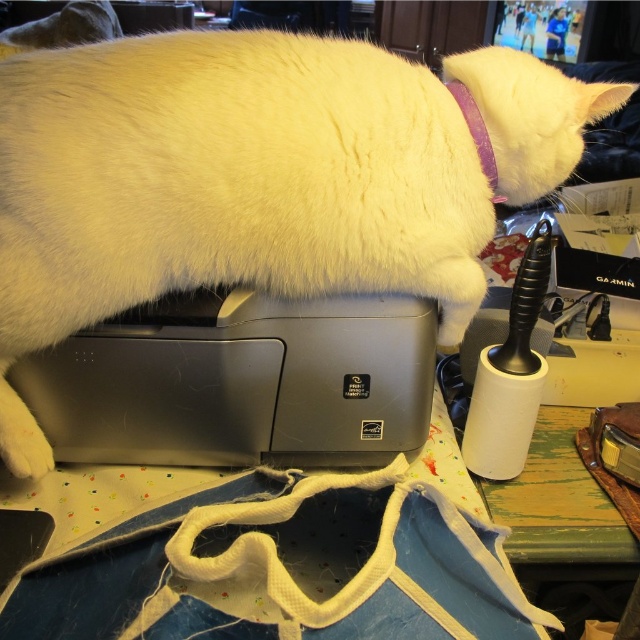
Can you confirm if satin silver printer at center is smaller than purple fabric neckband at upper right?

No.

Is satin silver printer at center to the right of purple fabric neckband at upper right from the viewer's perspective?

No, satin silver printer at center is not to the right of purple fabric neckband at upper right.

Is point (112, 440) closer to viewer compared to point (480, 136)?

No, it is behind (480, 136).

Where is `satin silver printer at center`? Image resolution: width=640 pixels, height=640 pixels. satin silver printer at center is located at coordinates (241, 384).

Can you confirm if white fluffy cat at upper center is taller than satin silver printer at center?

Correct, white fluffy cat at upper center is much taller as satin silver printer at center.

Who is shorter, white fluffy cat at upper center or satin silver printer at center?

→ Standing shorter between the two is satin silver printer at center.

What do you see at coordinates (225, 186) in the screenshot? I see `white fluffy cat at upper center` at bounding box center [225, 186].

Where is `white fluffy cat at upper center`? The height and width of the screenshot is (640, 640). white fluffy cat at upper center is located at coordinates (225, 186).

Does white fluffy cat at upper center appear on the right side of purple fabric neckband at upper right?

Incorrect, white fluffy cat at upper center is not on the right side of purple fabric neckband at upper right.

Who is shorter, white fluffy cat at upper center or purple fabric neckband at upper right?

purple fabric neckband at upper right

This screenshot has width=640, height=640. What do you see at coordinates (225, 186) in the screenshot?
I see `white fluffy cat at upper center` at bounding box center [225, 186].

The height and width of the screenshot is (640, 640). Find the location of `white fluffy cat at upper center`. white fluffy cat at upper center is located at coordinates (225, 186).